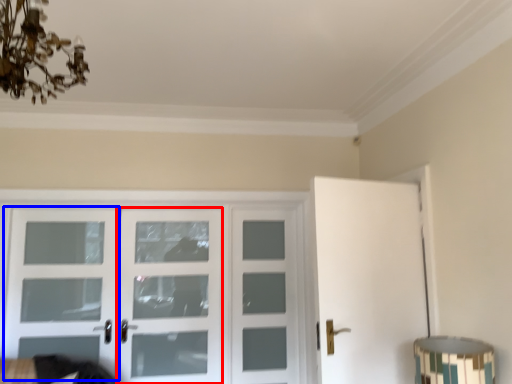
Question: Which of the following is the closest to the observer, screen door (highlighted by a red box) or screen door (highlighted by a blue box)?

Choices:
 (A) screen door
 (B) screen door

Answer: (B)